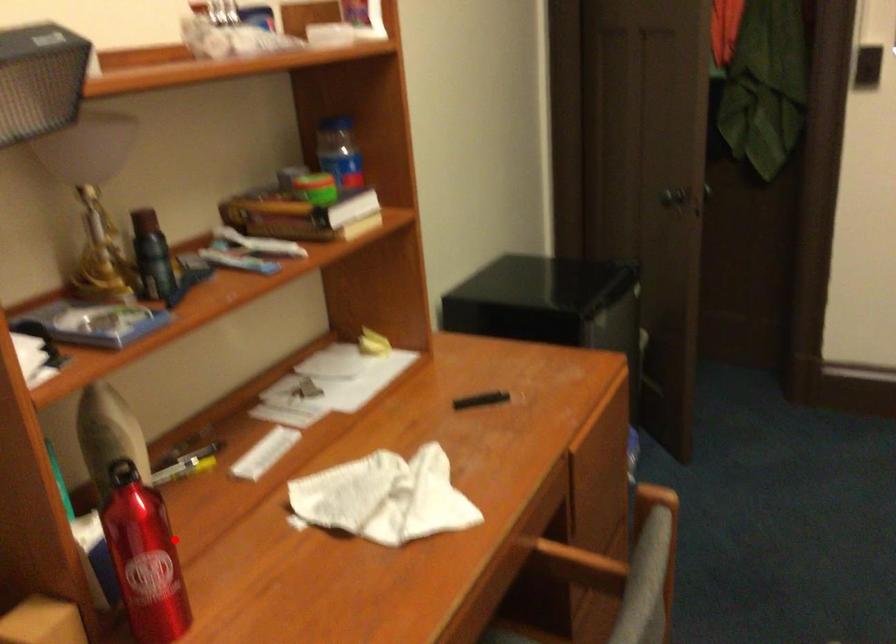
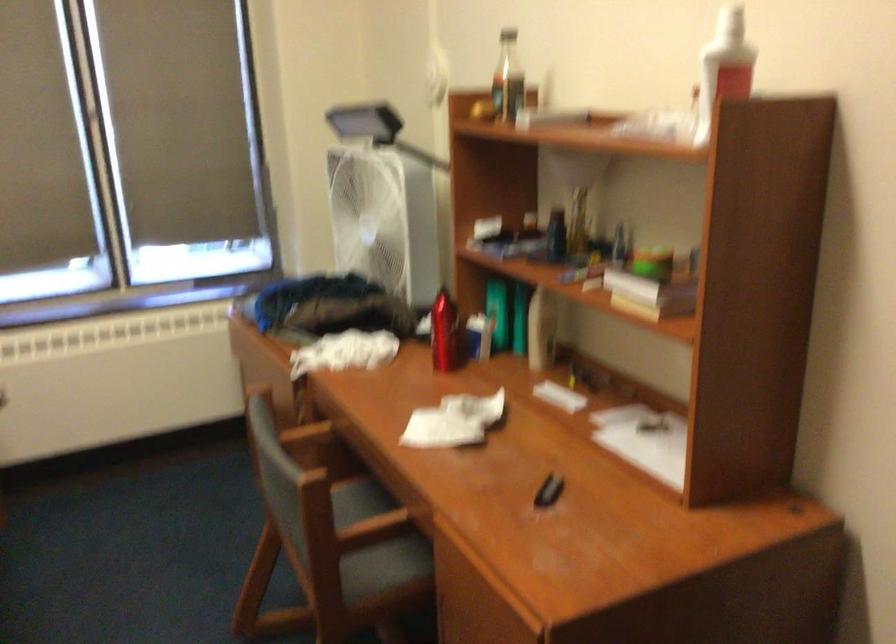
The point at the highlighted location is marked in the first image. Where is the corresponding point in the second image?

(444, 333)